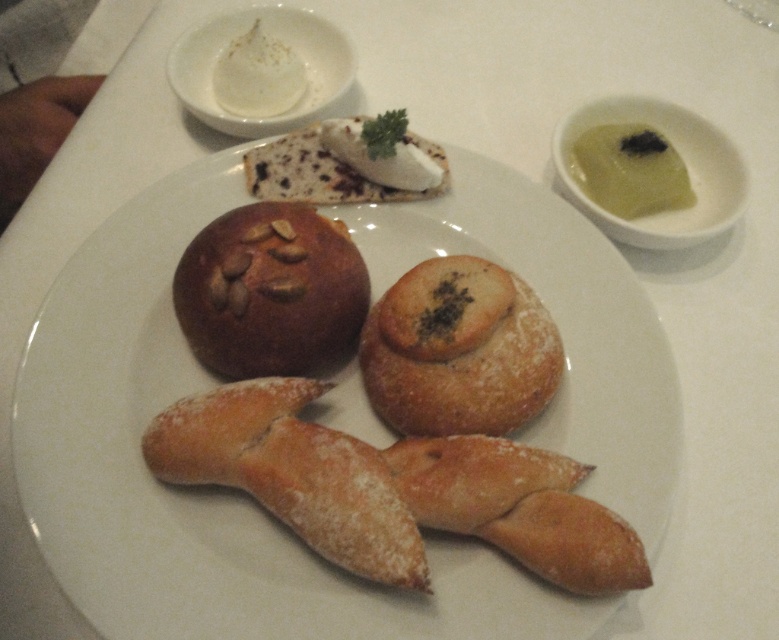
Based on the photo, between powdery golden-brown pastry at center and brown crusty bread at center, which one has less height?

powdery golden-brown pastry at center is shorter.

Is point (241, 403) positioned behind point (298, 333)?

No, it is not.

Identify the location of powdery golden-brown pastry at center. (x=291, y=474).

Is golden brown dough at center closer to camera compared to golden brown crusty bread at center?

Yes, golden brown dough at center is in front of golden brown crusty bread at center.

Who is more distant from viewer, (182, 602) or (439, 504)?

The point (439, 504) is more distant.

Between point (143, 624) and point (587, 554), which one is positioned in front?

Point (143, 624) is in front.

At what (x,y) coordinates should I click in order to perform the action: click on golden brown dough at center. Please return your answer as a coordinate pair (x, y). The width and height of the screenshot is (779, 640). Looking at the image, I should click on (203, 488).

Does brown crusty bread at center come in front of green creamy sauce at upper right?

Yes, brown crusty bread at center is in front of green creamy sauce at upper right.

Is brown crusty bread at center wider than green creamy sauce at upper right?

Correct, the width of brown crusty bread at center exceeds that of green creamy sauce at upper right.

Is point (365, 296) positioned behind point (675, 164)?

No, (365, 296) is in front of (675, 164).

The image size is (779, 640). In order to click on brown crusty bread at center in this screenshot , I will do click(x=270, y=291).